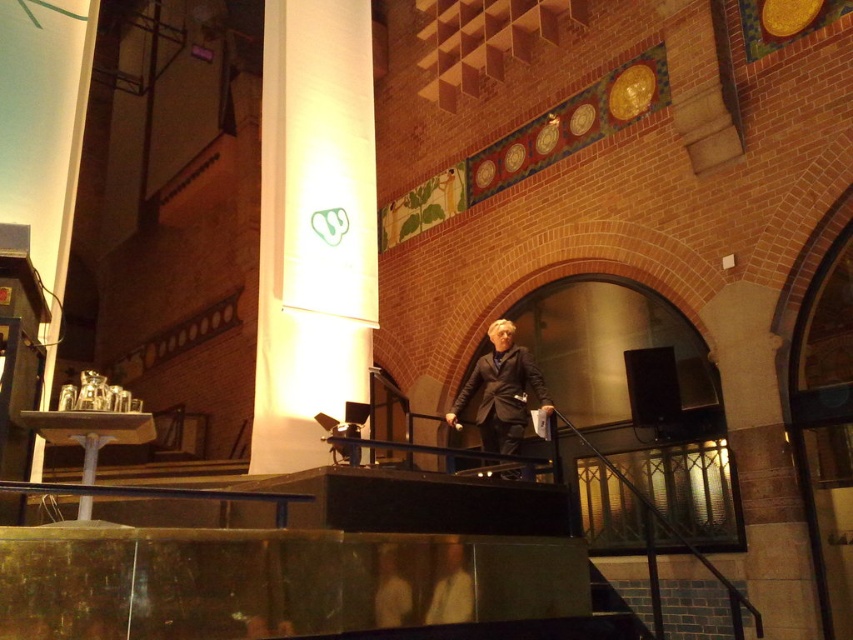
Question: Is light beige suit at center positioned at the back of light brown leather jacket at center?

Choices:
 (A) no
 (B) yes

Answer: (B)

Question: Among these objects, which one is farthest from the camera?

Choices:
 (A) light brown leather jacket at center
 (B) light beige suit at center
 (C) dark gray suit at center

Answer: (C)

Question: Does brick wall at upper center have a smaller size compared to light beige suit at center?

Choices:
 (A) yes
 (B) no

Answer: (B)

Question: Is white paper at center below dark gray suit at center?

Choices:
 (A) no
 (B) yes

Answer: (A)

Question: Estimate the real-world distances between objects in this image. Which object is closer to the light brown leather jacket at center?

Choices:
 (A) dark gray suit at center
 (B) light beige suit at center
 (C) white paper at center

Answer: (B)

Question: Which object is positioned closest to the brick wall at upper center?

Choices:
 (A) light beige suit at center
 (B) light brown leather jacket at center

Answer: (A)